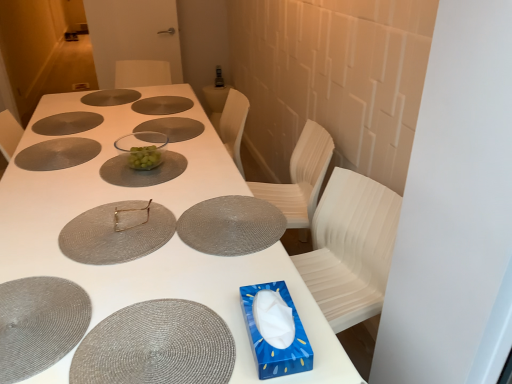
Find the location of `vacant space that is in between matte gray glass plate at upper left, the third glass plate in the back-to-front sequence, and matte gray glass plate at upper left, which is the 5th glass plate in back-to-front order`. vacant space that is in between matte gray glass plate at upper left, the third glass plate in the back-to-front sequence, and matte gray glass plate at upper left, which is the 5th glass plate in back-to-front order is located at coordinates (58, 132).